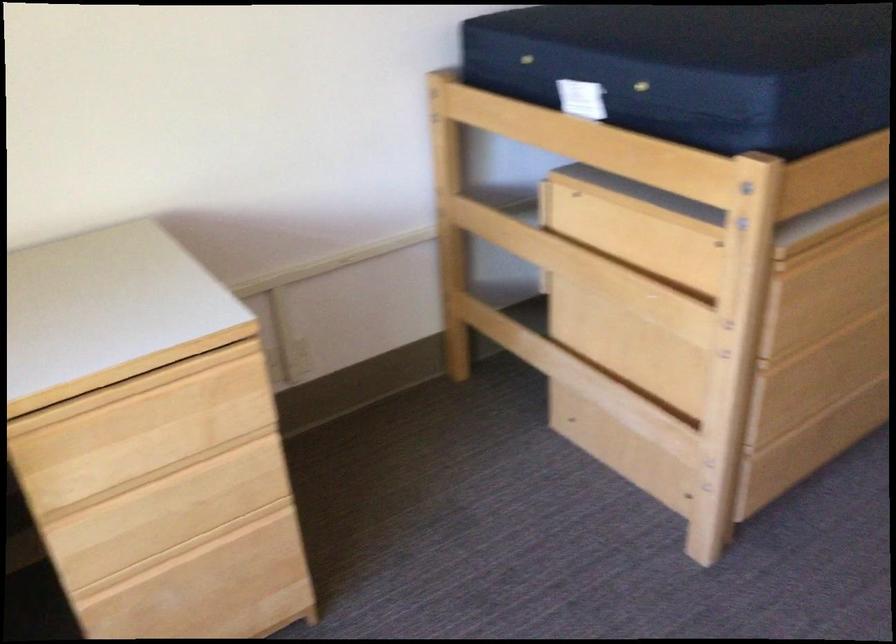
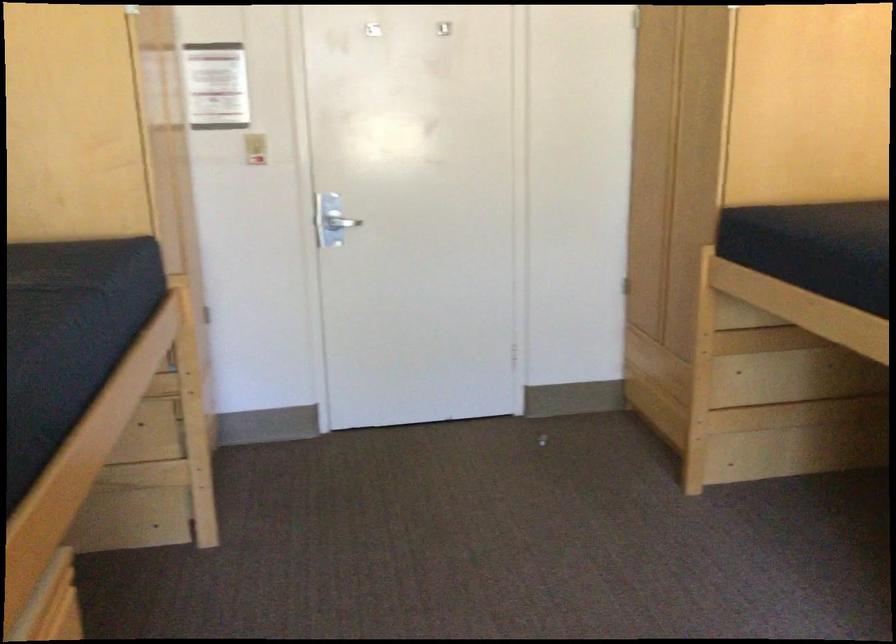
Question: Based on the continuous images, in which direction is the camera rotating? Reply with the corresponding letter.

Choices:
 (A) Left
 (B) Right
 (C) Up
 (D) Down

Answer: (B)